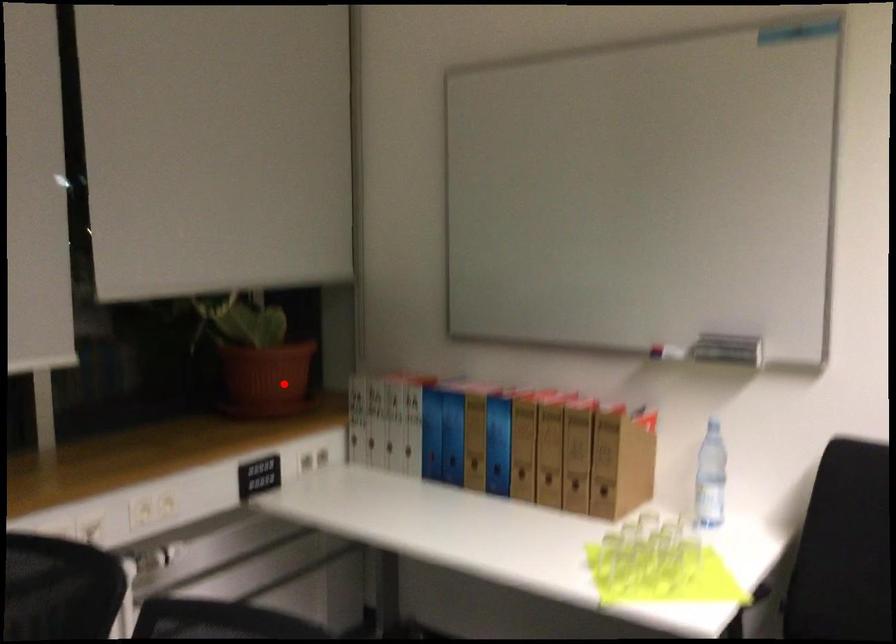
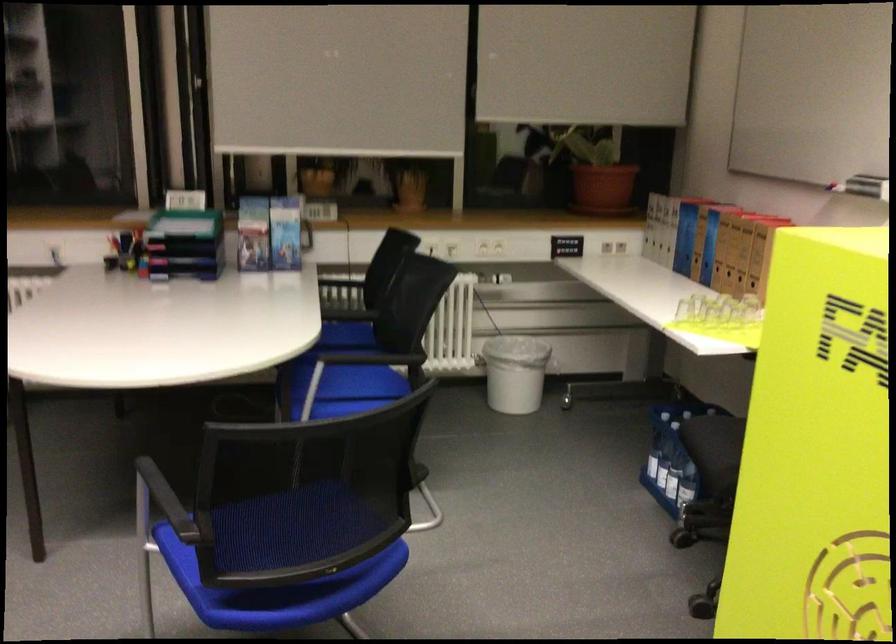
In the second image, find the point that corresponds to the highlighted location in the first image.

(602, 187)